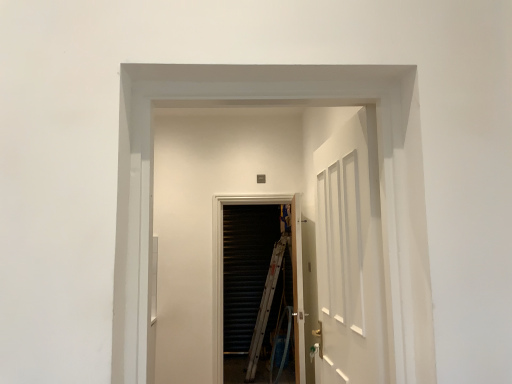
Question: Is white glossy elevator at center facing towards white wooden door at center?

Choices:
 (A) yes
 (B) no

Answer: (B)

Question: Considering the relative sizes of white glossy elevator at center and white wooden door at center in the image provided, is white glossy elevator at center bigger than white wooden door at center?

Choices:
 (A) no
 (B) yes

Answer: (A)

Question: Is white glossy elevator at center in contact with white wooden door at center?

Choices:
 (A) no
 (B) yes

Answer: (A)

Question: Is the depth of white glossy elevator at center greater than that of white wooden door at center?

Choices:
 (A) yes
 (B) no

Answer: (B)

Question: Does white glossy elevator at center have a lesser height compared to white wooden door at center?

Choices:
 (A) no
 (B) yes

Answer: (B)

Question: Is white glossy elevator at center to the left of white wooden door at center from the viewer's perspective?

Choices:
 (A) no
 (B) yes

Answer: (B)

Question: Is white wooden door at center positioned far away from white glossy elevator at center?

Choices:
 (A) yes
 (B) no

Answer: (A)

Question: From the image's perspective, is white wooden door at center beneath white glossy elevator at center?

Choices:
 (A) no
 (B) yes

Answer: (B)

Question: Is white wooden door at center thinner than white glossy elevator at center?

Choices:
 (A) yes
 (B) no

Answer: (A)

Question: From a real-world perspective, is white wooden door at center beneath white glossy elevator at center?

Choices:
 (A) no
 (B) yes

Answer: (B)

Question: Can you confirm if white wooden door at center is positioned to the left of white glossy elevator at center?

Choices:
 (A) no
 (B) yes

Answer: (A)

Question: Is white glossy elevator at center completely or partially inside white wooden door at center?

Choices:
 (A) yes
 (B) no

Answer: (B)

Question: Is black metal screen door at center shorter than white glossy elevator at center?

Choices:
 (A) no
 (B) yes

Answer: (A)